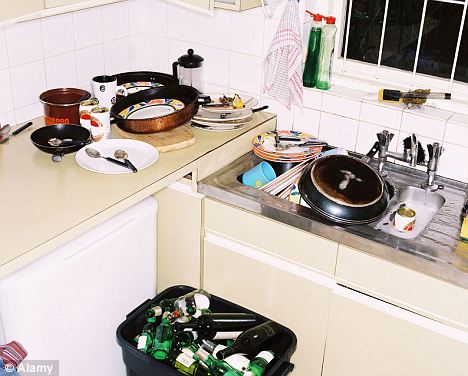
You are a GUI agent. You are given a task and a screenshot of the screen. Output one action in this format:
    pyautogui.click(x=<x>, y=<y>)
    Task: Click on the bin
    This screenshot has height=376, width=468.
    Given the screenshot: What is the action you would take?
    pyautogui.click(x=289, y=345)